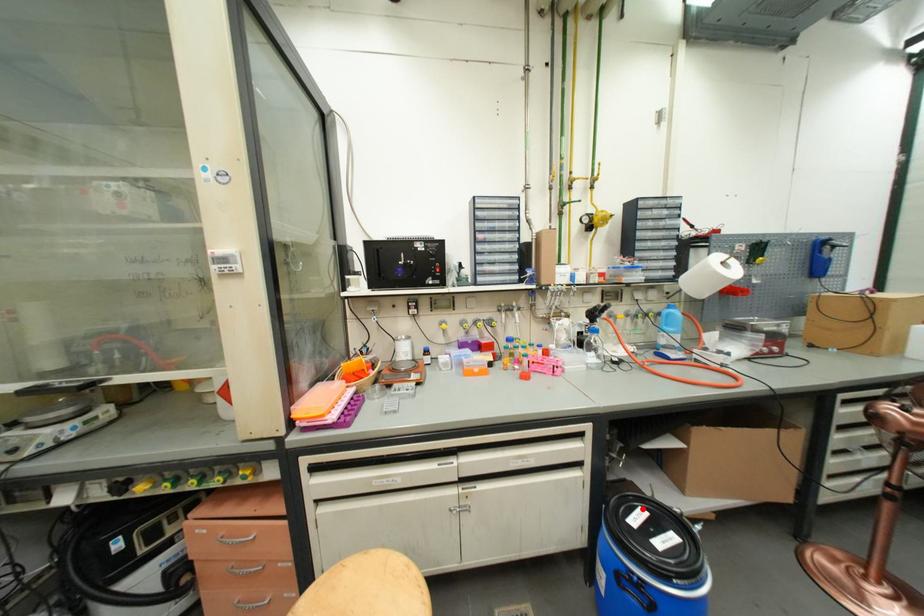
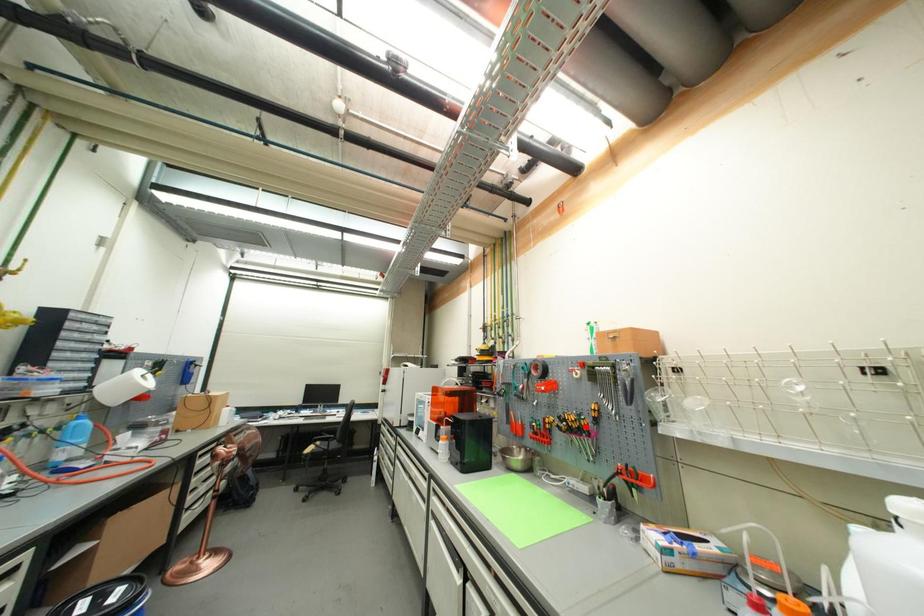
I am providing you with two images of the same scene from different viewpoints. A red point is marked on the first image and another point is marked on the second image. Are the points marked in image1 and image2 representing the same 3D position?

No